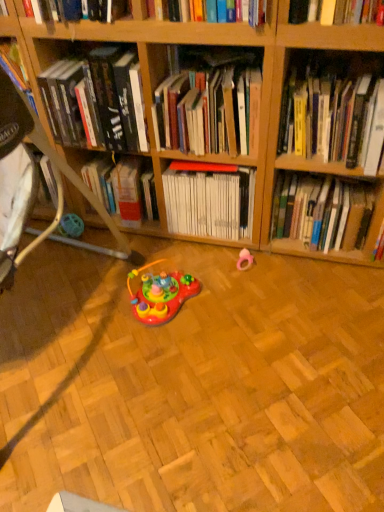
Find the location of a particular element. This screenshot has width=384, height=512. free space below shiny plastic toy at center, which is the first toy in left-to-right order (from a real-world perspective) is located at coordinates (174, 312).